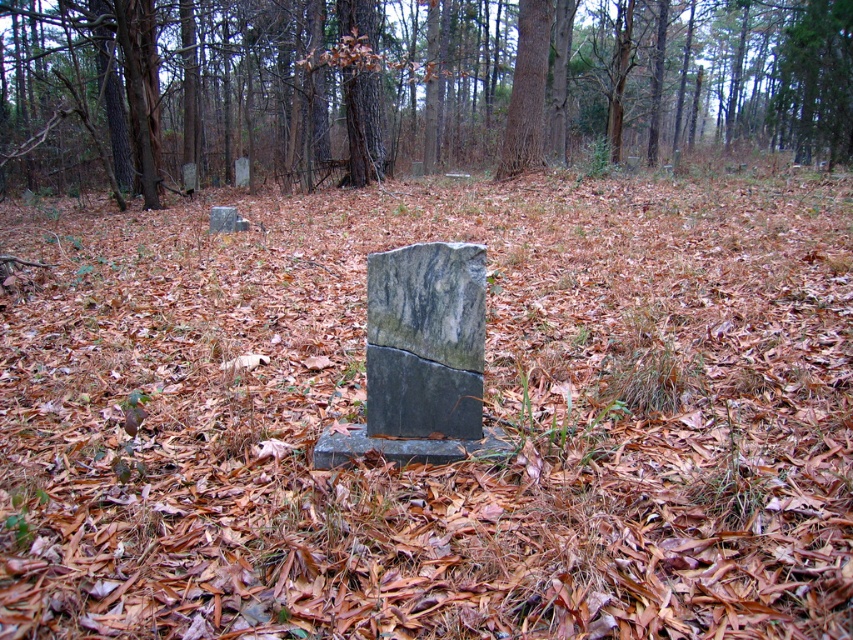
Question: Considering the real-world distances, which object is closest to the smooth brown bark at center?

Choices:
 (A) marble gravestone at center
 (B) smooth gray stone at center

Answer: (B)

Question: Is marble gravestone at center in front of smooth brown bark at center?

Choices:
 (A) no
 (B) yes

Answer: (B)

Question: Is smooth gray stone at center smaller than smooth brown bark at center?

Choices:
 (A) yes
 (B) no

Answer: (B)

Question: Does marble gravestone at center have a larger size compared to smooth brown bark at center?

Choices:
 (A) no
 (B) yes

Answer: (A)

Question: Among these points, which one is farthest from the camera?

Choices:
 (A) [x=186, y=170]
 (B) [x=527, y=60]

Answer: (A)

Question: Which of these objects is positioned farthest from the marble gravestone at center?

Choices:
 (A) smooth brown bark at center
 (B) smooth gray stone at center

Answer: (B)